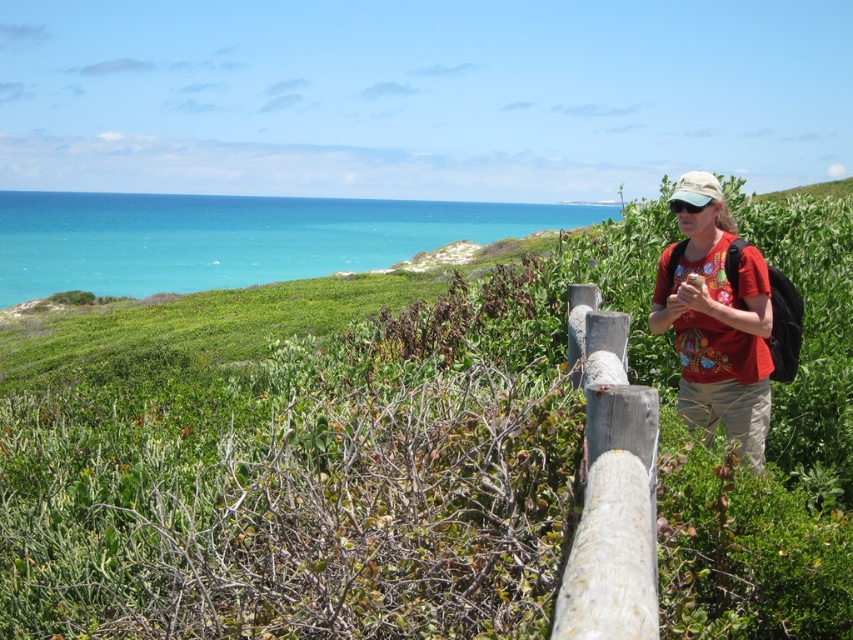
Question: Can you confirm if green leafy grass at center is wider than red cotton shirt at center?

Choices:
 (A) no
 (B) yes

Answer: (B)

Question: Does weathered wood fence at right have a lesser width compared to red cotton shirt at center?

Choices:
 (A) no
 (B) yes

Answer: (B)

Question: Which point is closer to the camera?

Choices:
 (A) green leafy grass at center
 (B) red cotton shirt at center

Answer: (A)

Question: Which point is farther to the camera?

Choices:
 (A) red cotton shirt at center
 (B) green leafy grass at center
 (C) weathered wood fence at right

Answer: (A)

Question: In this image, where is weathered wood fence at right located relative to red cotton shirt at center?

Choices:
 (A) below
 (B) above

Answer: (A)

Question: Which of these objects is positioned farthest from the green leafy grass at center?

Choices:
 (A) red cotton shirt at center
 (B) weathered wood fence at right

Answer: (B)